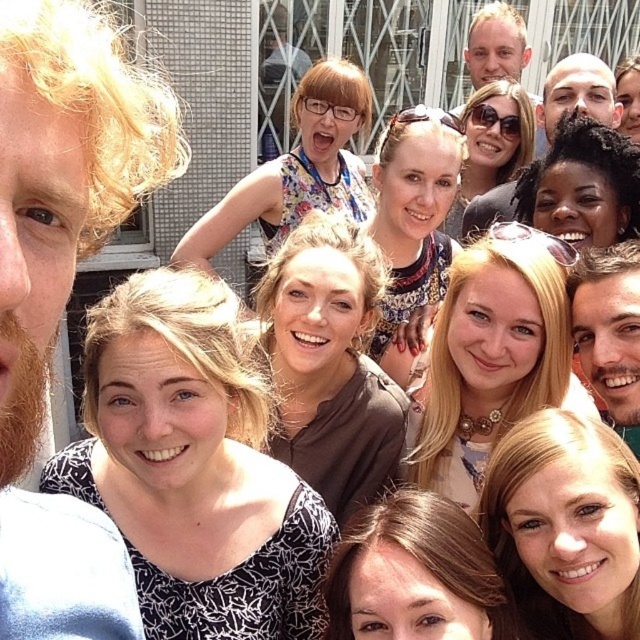
Question: Among these points, which one is nearest to the camera?

Choices:
 (A) (24, 29)
 (B) (616, 81)
 (C) (352, 74)
 (D) (410, 332)

Answer: (A)

Question: Considering the relative positions of floral dress at upper center and sunglasses at center in the image provided, where is floral dress at upper center located with respect to sunglasses at center?

Choices:
 (A) right
 (B) left

Answer: (B)

Question: Can you confirm if white printed blouse at center is positioned to the right of matte brown hair at center?

Choices:
 (A) yes
 (B) no

Answer: (B)

Question: Which object is the closest to the patterned fabric dress at center?

Choices:
 (A) blonde hair at lower center
 (B) dark brown curly hair at center
 (C) floral dress at upper center
 (D) matte brown hair at center

Answer: (B)

Question: Which point is farther from the camera taking this photo?

Choices:
 (A) (477, 120)
 (B) (500, 621)

Answer: (A)

Question: Does white printed blouse at center have a greater width compared to blonde hair at center?

Choices:
 (A) no
 (B) yes

Answer: (B)